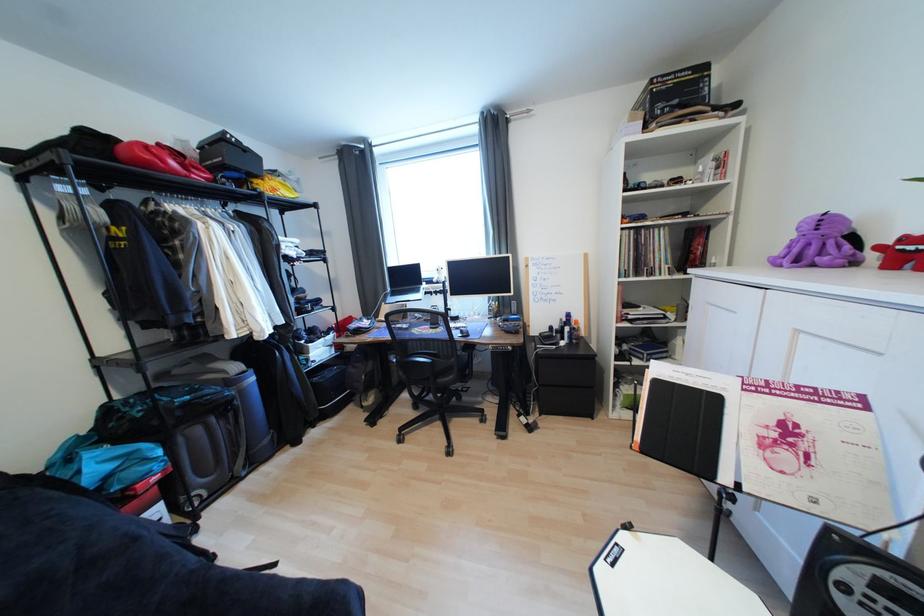
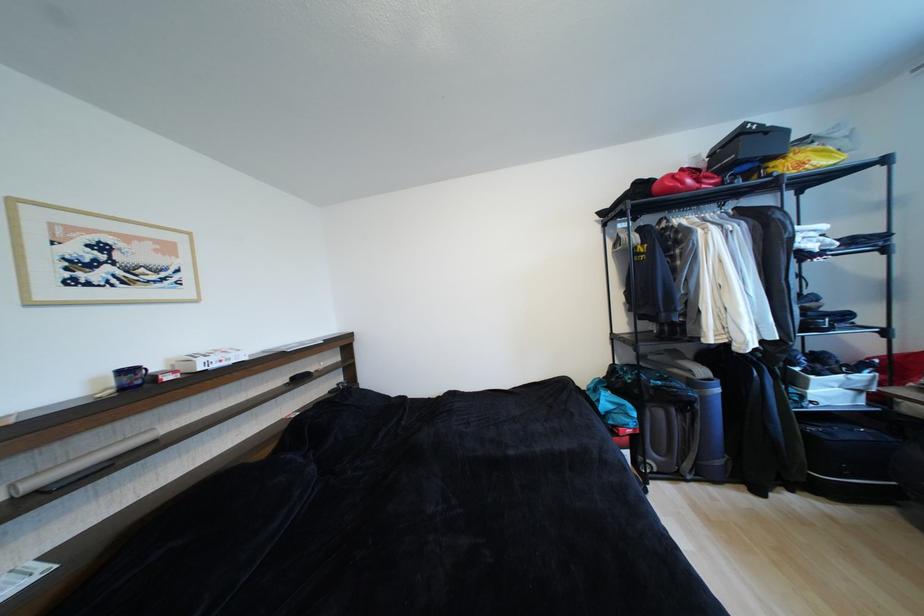
Locate, in the second image, the point that corresponds to pixel 262 183 in the first image.

(780, 166)